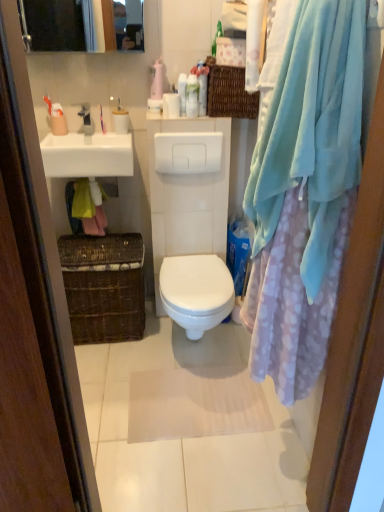
Find the location of a particular element. The width and height of the screenshot is (384, 512). free location to the right of satin silver faucet at upper center is located at coordinates (110, 138).